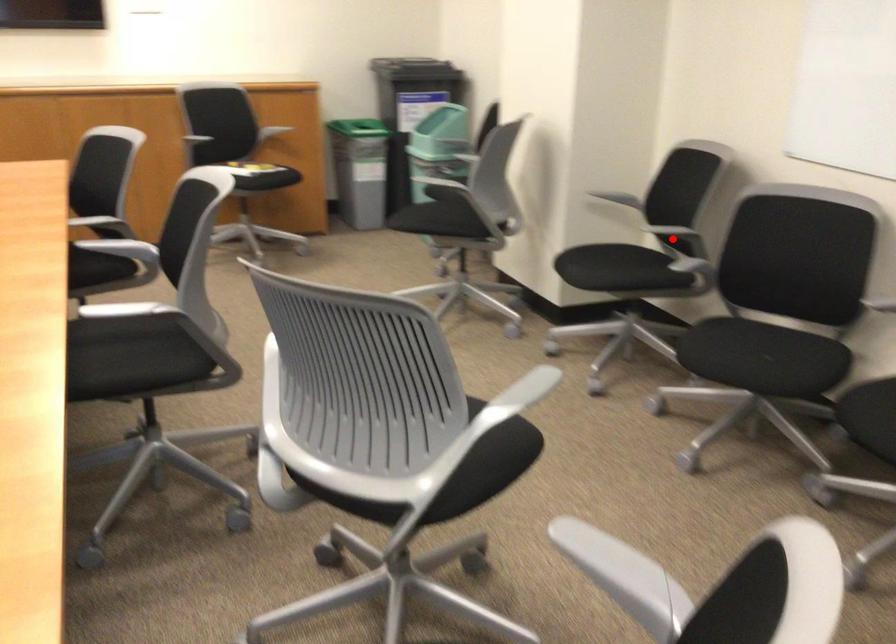
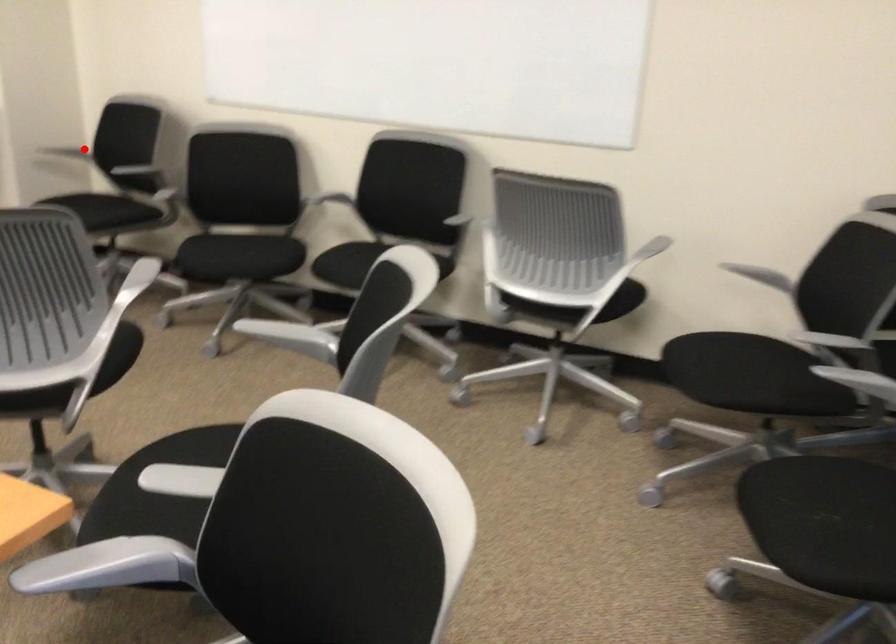
I am providing you with two images of the same scene from different viewpoints. A red point is marked on the first image and another point is marked on the second image. Is the red point in image1 aligned with the point shown in image2?

No